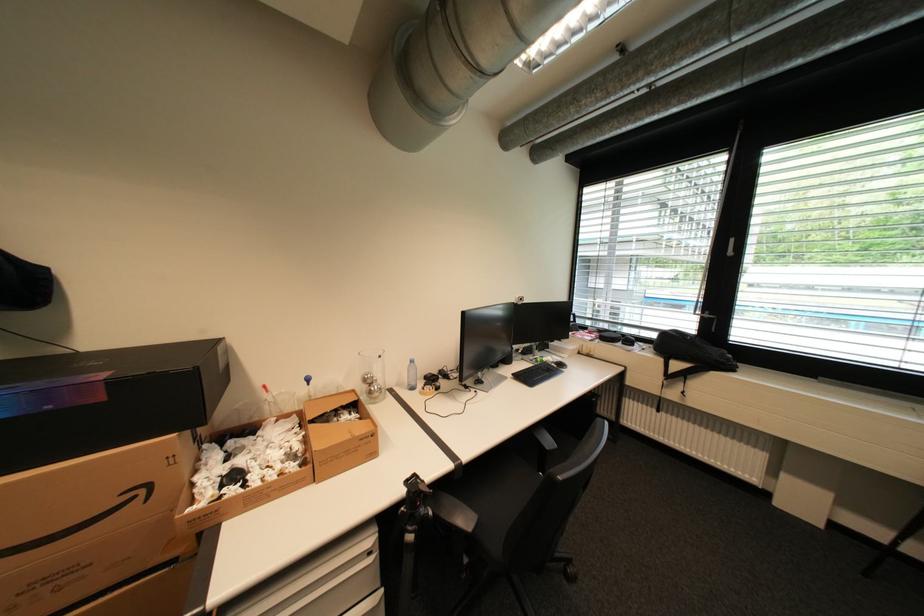
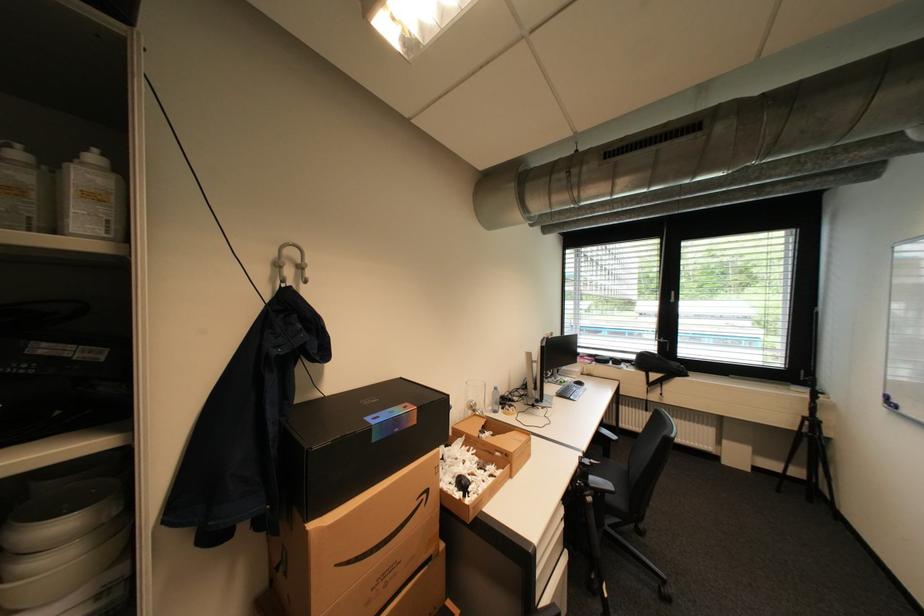
In the second image, find the point that corresponds to the point at 237,469 in the first image.

(462, 477)